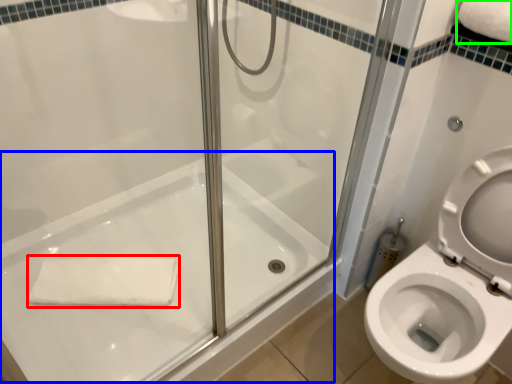
Question: Which is nearer to the bath towel (highlighted by a red box)? bath (highlighted by a blue box) or bath towel (highlighted by a green box).

Choices:
 (A) bath
 (B) bath towel

Answer: (A)